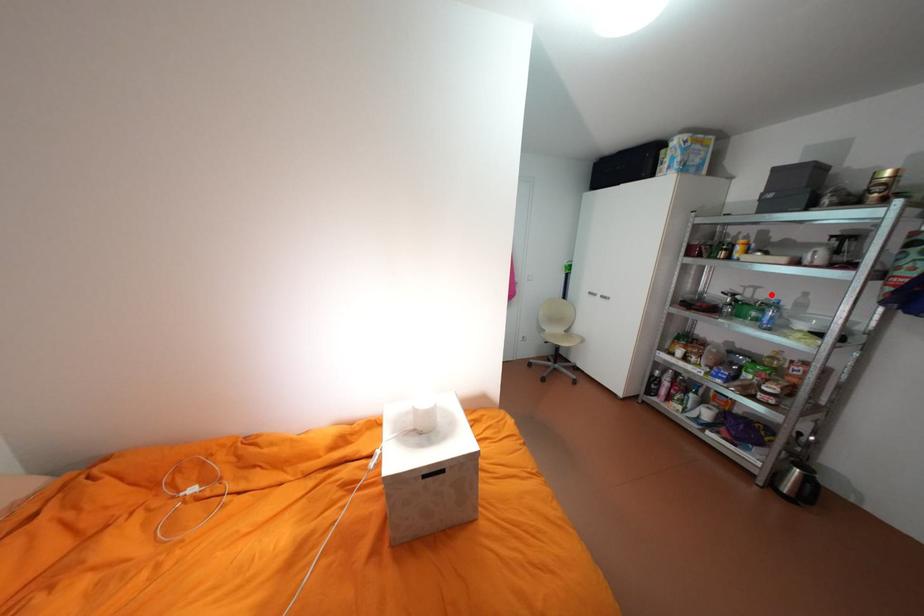
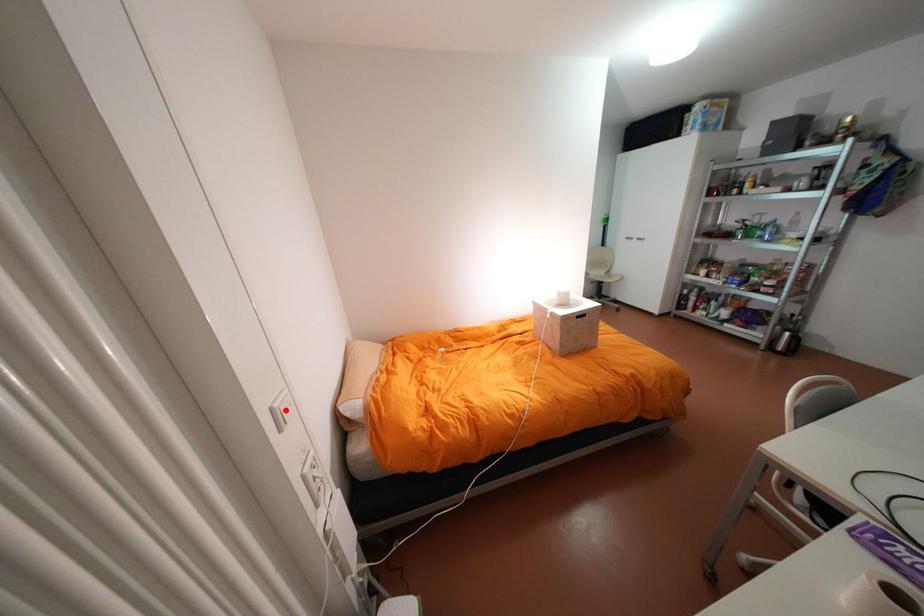
I am providing you with two images of the same scene from different viewpoints. A red point is marked on the first image and another point is marked on the second image. Is the red point in image1 aligned with the point shown in image2?

No